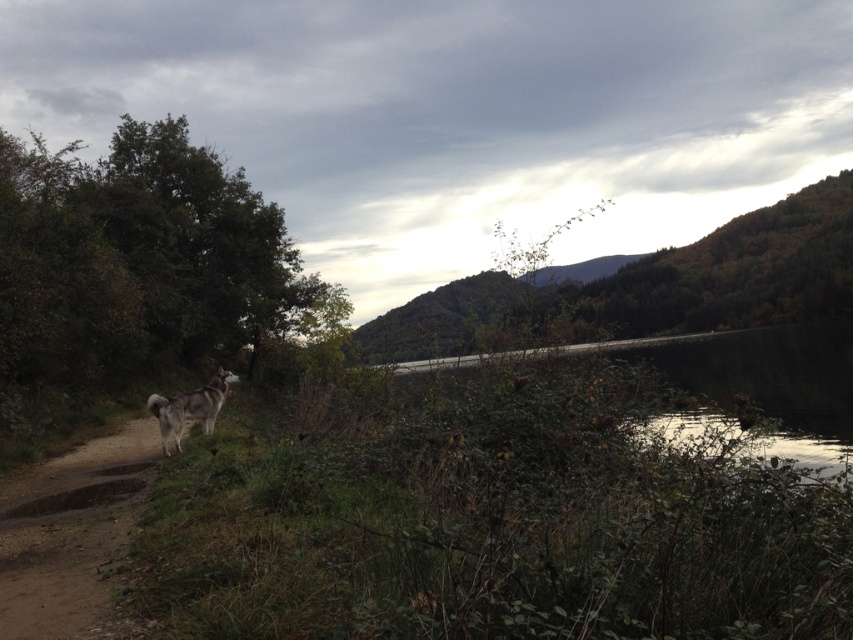
Locate an element on the screen. The width and height of the screenshot is (853, 640). smooth concrete wall at center is located at coordinates (770, 381).

Is smooth concrete wall at center to the right of white fur dog at lower left from the viewer's perspective?

Indeed, smooth concrete wall at center is positioned on the right side of white fur dog at lower left.

At what (x,y) coordinates should I click in order to perform the action: click on smooth concrete wall at center. Please return your answer as a coordinate pair (x, y). The height and width of the screenshot is (640, 853). Looking at the image, I should click on (770, 381).

Is dirt path at left bigger than white fur dog at lower left?

Yes, dirt path at left is bigger than white fur dog at lower left.

Can you confirm if dirt path at left is shorter than white fur dog at lower left?

Yes, dirt path at left is shorter than white fur dog at lower left.

Who is more distant from viewer, (125, 502) or (224, 372)?

Positioned behind is point (224, 372).

I want to click on dirt path at left, so pos(70,534).

Who is more forward, (28,634) or (721,397)?

Point (28,634)

Is dirt path at left to the left of smooth concrete wall at center from the viewer's perspective?

Yes, dirt path at left is to the left of smooth concrete wall at center.

Is point (74, 486) positioned in front of point (821, 404)?

Yes.

Where is `dirt path at left`? The height and width of the screenshot is (640, 853). dirt path at left is located at coordinates (70, 534).